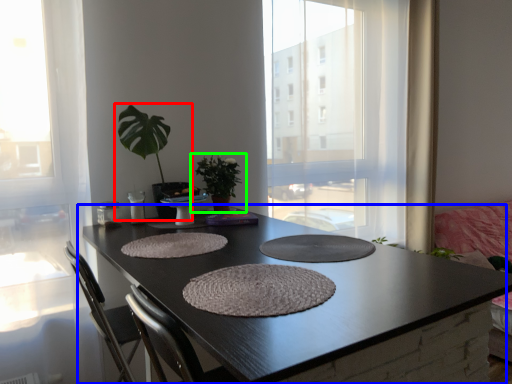
Question: Based on their relative distances, which object is farther from houseplant (highlighted by a red box)? Choose from coffee table (highlighted by a blue box) and houseplant (highlighted by a green box).

Choices:
 (A) coffee table
 (B) houseplant

Answer: (A)